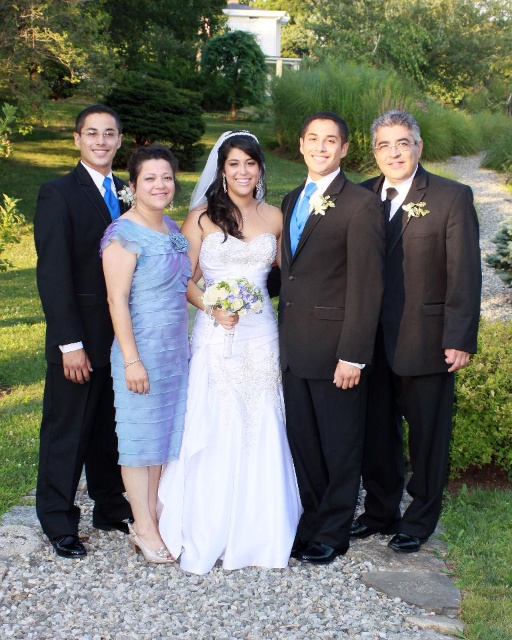
Question: Which object is closer to the camera taking this photo?

Choices:
 (A) black satin suit at right
 (B) black satin suit at center
 (C) white satin dress at center
 (D) light blue chiffon dress at center

Answer: (C)

Question: Which object is the farthest from the black satin suit at right?

Choices:
 (A) light blue chiffon dress at center
 (B) shiny black suit at left
 (C) white satin dress at center
 (D) black satin suit at center

Answer: (B)

Question: Can you confirm if black satin suit at right is positioned to the left of white satin dress at center?

Choices:
 (A) yes
 (B) no

Answer: (B)

Question: Is white satin dress at center to the right of light blue chiffon dress at center from the viewer's perspective?

Choices:
 (A) no
 (B) yes

Answer: (B)

Question: Which of the following is the closest to the observer?

Choices:
 (A) shiny black suit at left
 (B) black satin suit at center
 (C) black satin suit at right
 (D) light blue chiffon dress at center

Answer: (C)

Question: Observing the image, what is the correct spatial positioning of white satin dress at center in reference to light blue chiffon dress at center?

Choices:
 (A) left
 (B) right

Answer: (B)